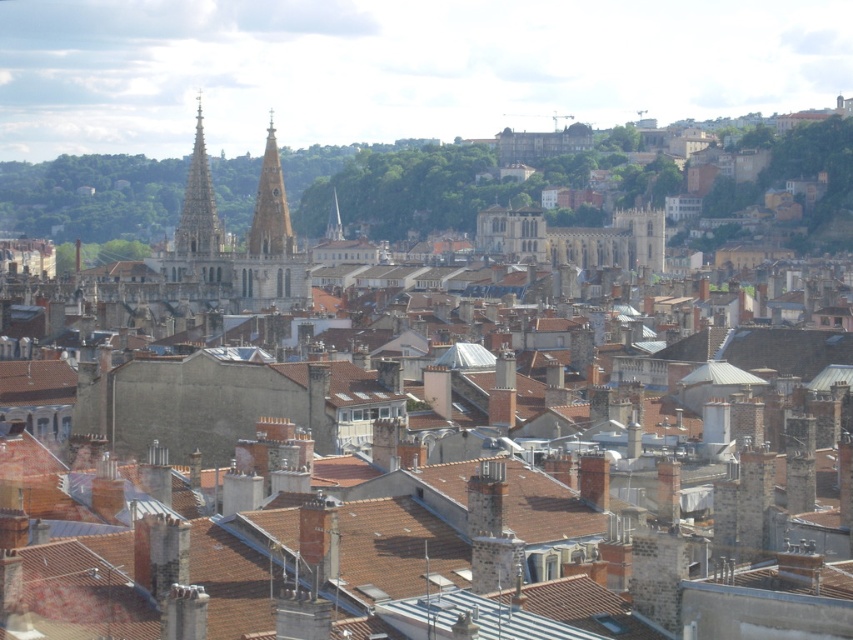
Which of these two, marble-like stone tower at center or polished stone spire at upper left, stands taller?

Standing taller between the two is marble-like stone tower at center.

Does point (282, 205) come closer to viewer compared to point (195, 208)?

Yes, it is in front of point (195, 208).

The image size is (853, 640). Describe the element at coordinates (270, 246) in the screenshot. I see `marble-like stone tower at center` at that location.

Where is `marble-like stone tower at center`? Image resolution: width=853 pixels, height=640 pixels. marble-like stone tower at center is located at coordinates (270, 246).

Does polished stone spire at upper left have a larger size compared to smooth stone spire at center?

No.

Can you confirm if polished stone spire at upper left is smaller than smooth stone spire at center?

Correct, polished stone spire at upper left occupies less space than smooth stone spire at center.

Does point (200, 208) come in front of point (337, 228)?

Yes, it is.

Where is `polished stone spire at upper left`? Image resolution: width=853 pixels, height=640 pixels. polished stone spire at upper left is located at coordinates pyautogui.click(x=198, y=204).

Identify the location of marble-like stone tower at center. (270, 246).

Consider the image. Can you confirm if marble-like stone tower at center is smaller than smooth stone tower at center?

Incorrect, marble-like stone tower at center is not smaller in size than smooth stone tower at center.

The image size is (853, 640). I want to click on marble-like stone tower at center, so coord(270,246).